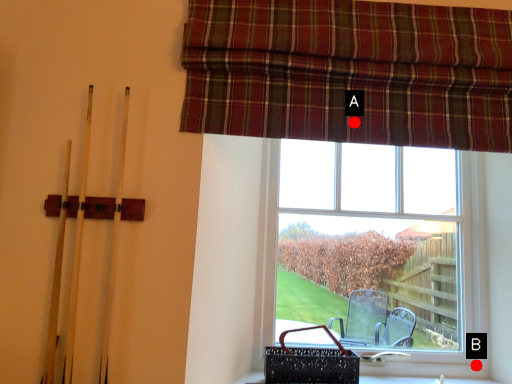
Question: Two points are circled on the image, labeled by A and B beside each circle. Which point is closer to the camera taking this photo?

Choices:
 (A) A is closer
 (B) B is closer

Answer: (A)